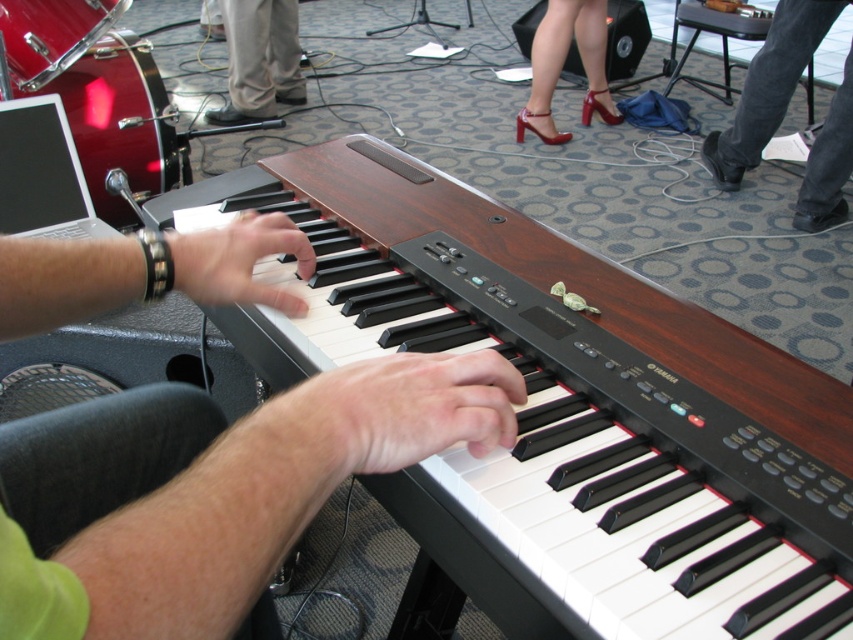
Is matte black hand at center positioned at the back of tan fabric pants at center?

No, matte black hand at center is in front of tan fabric pants at center.

Is matte black hand at center to the right of tan fabric pants at center from the viewer's perspective?

Correct, you'll find matte black hand at center to the right of tan fabric pants at center.

Image resolution: width=853 pixels, height=640 pixels. Find the location of `matte black hand at center`. matte black hand at center is located at coordinates (241, 260).

Where is `matte black hand at center`? The image size is (853, 640). matte black hand at center is located at coordinates (241, 260).

From the picture: Between wooden piano at center and black leather shoe at lower right, which one appears on the left side from the viewer's perspective?

wooden piano at center

What do you see at coordinates (561, 410) in the screenshot? The image size is (853, 640). I see `wooden piano at center` at bounding box center [561, 410].

Is point (793, 435) farther from camera compared to point (788, 58)?

No, it is in front of (788, 58).

Locate an element on the screen. wooden piano at center is located at coordinates (561, 410).

Is green fabric pants at center positioned before tan fabric pants at center?

Yes, green fabric pants at center is closer to the viewer.

Does point (387, 445) come closer to viewer compared to point (241, 49)?

That is True.

Between point (200, 458) and point (260, 61), which one is positioned in front?

Point (200, 458) is more forward.

Where is `green fabric pants at center`? green fabric pants at center is located at coordinates (273, 490).